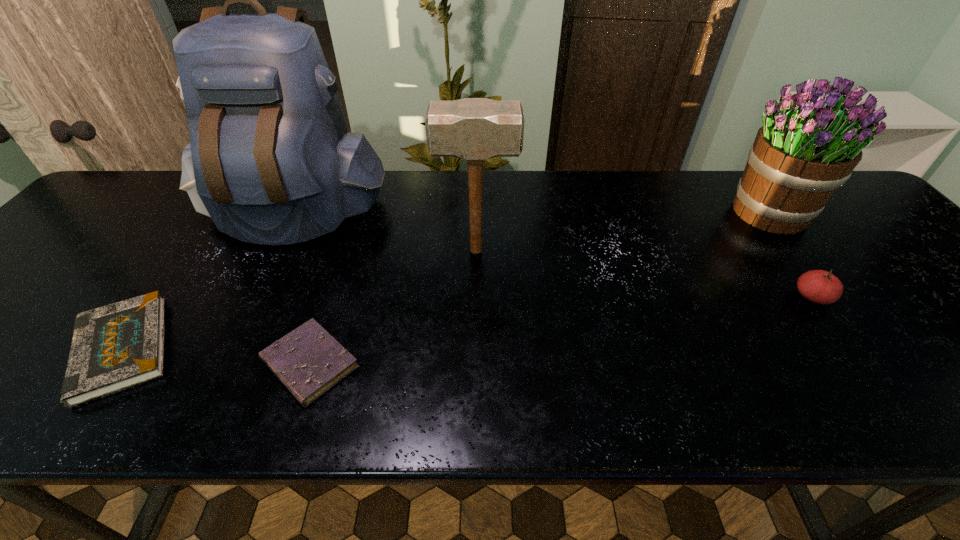
This screenshot has height=540, width=960. Find the location of `free space between the backpack and the bouquet`. free space between the backpack and the bouquet is located at coordinates (531, 213).

Locate which object is the closest to the notebook. Please provide its 2D coordinates. Your answer should be formatted as a tuple, i.e. [(x, y)], where the tuple contains the x and y coordinates of a point satisfying the conditions above.

[(270, 160)]

I want to click on object identified as the closest to the diary, so click(115, 347).

The image size is (960, 540). In order to click on free spot that satisfies the following two spatial constraints: 1. at the front pocket of the backpack; 2. on the left side of the bouquet in this screenshot , I will do `click(293, 213)`.

Identify the location of free space that satisfies the following two spatial constraints: 1. on the front side of the shortest object; 2. on the left side of the notebook. The height and width of the screenshot is (540, 960). (112, 363).

This screenshot has width=960, height=540. Find the location of `vacant space that satisfies the following two spatial constraints: 1. on the striking face of the third shortest object; 2. on the right side of the fourth object from left to right`. vacant space that satisfies the following two spatial constraints: 1. on the striking face of the third shortest object; 2. on the right side of the fourth object from left to right is located at coordinates (475, 297).

This screenshot has width=960, height=540. I want to click on free space that satisfies the following two spatial constraints: 1. at the front pocket of the tallest object; 2. on the left side of the diary, so click(x=217, y=363).

At what (x,y) coordinates should I click in order to perform the action: click on free space that satisfies the following two spatial constraints: 1. on the back side of the bouquet; 2. on the right side of the notebook. Please return your answer as a coordinate pair (x, y). This screenshot has height=540, width=960. Looking at the image, I should click on (217, 213).